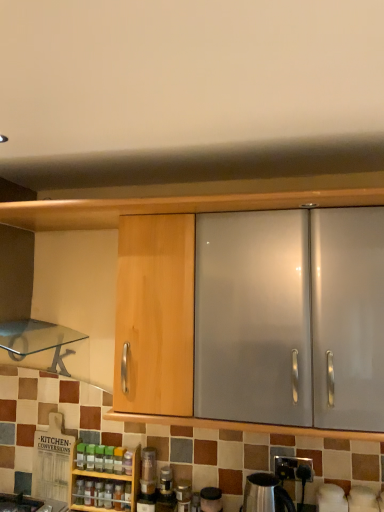
What do you see at coordinates (211, 499) in the screenshot?
I see `metallic silver kettle at center, arranged as the third appliance when viewed from the right` at bounding box center [211, 499].

Locate an element on the screen. This screenshot has height=512, width=384. satin silver kettle at lower center, marked as the second appliance in a left-to-right arrangement is located at coordinates (265, 494).

What do you see at coordinates (265, 494) in the screenshot? I see `satin silver kettle at lower center, marked as the second appliance in a left-to-right arrangement` at bounding box center [265, 494].

Where is `black plastic outlet at lower center`? This screenshot has height=512, width=384. black plastic outlet at lower center is located at coordinates (294, 468).

At what (x,y) coordinates should I click in order to perform the action: click on translucent plastic spice bottle at lower left, the 5th bottle in the left-to-right sequence. Please return your answer as a coordinate pair (x, y). Looking at the image, I should click on (108, 495).

What do you see at coordinates (108, 495) in the screenshot? I see `translucent plastic spice bottle at lower left, the 5th bottle in the left-to-right sequence` at bounding box center [108, 495].

What do you see at coordinates (118, 496) in the screenshot? This screenshot has width=384, height=512. I see `translucent plastic bottle at center, the third bottle positioned from the right` at bounding box center [118, 496].

This screenshot has width=384, height=512. I want to click on metallic silver kettle at center, marked as the first appliance in a left-to-right arrangement, so click(211, 499).

Is translucent plastic bottle at center, positioned as the 2th bottle in left-to-right order, facing away from translucent plastic bottles at center, which ranks as the eighth bottle in right-to-left order?

That's not correct — translucent plastic bottle at center, positioned as the 2th bottle in left-to-right order, is not looking away from translucent plastic bottles at center, which ranks as the eighth bottle in right-to-left order.

From the image's perspective, is translucent plastic bottle at center, positioned as the 2th bottle in left-to-right order, under translucent plastic bottles at center, which ranks as the eighth bottle in right-to-left order?

Yes.

How distant is translucent plastic bottle at center, positioned as the 2th bottle in left-to-right order, from translucent plastic bottles at center, the first bottle in the left-to-right sequence?

The distance of translucent plastic bottle at center, positioned as the 2th bottle in left-to-right order, from translucent plastic bottles at center, the first bottle in the left-to-right sequence, is 3.99 inches.

Looking at the image, does translucent plastic bottle at center, positioned as the 2th bottle in left-to-right order, seem bigger or smaller compared to translucent plastic bottles at center, the first bottle in the left-to-right sequence?

Clearly, translucent plastic bottle at center, positioned as the 2th bottle in left-to-right order, is smaller in size than translucent plastic bottles at center, the first bottle in the left-to-right sequence.

From a real-world perspective, which object rests below the other?

translucent plastic spice bottle at lower left, the 5th bottle in the left-to-right sequence.

Is translucent plastic spice bottle at lower left, the 5th bottle in the left-to-right sequence, bigger or smaller than green plastic bottle at lower center, the fifth bottle positioned from the right?

Clearly, translucent plastic spice bottle at lower left, the 5th bottle in the left-to-right sequence, is larger in size than green plastic bottle at lower center, the fifth bottle positioned from the right.

Which is in front, translucent plastic spice bottle at lower left, the fourth bottle positioned from the right, or green plastic bottle at lower center, acting as the 4th bottle starting from the left?

translucent plastic spice bottle at lower left, the fourth bottle positioned from the right, is in front.

Could you measure the distance between translucent plastic spice bottle at lower left, the fourth bottle positioned from the right, and green plastic bottle at lower center, acting as the 4th bottle starting from the left?

translucent plastic spice bottle at lower left, the fourth bottle positioned from the right, is 3.64 inches away from green plastic bottle at lower center, acting as the 4th bottle starting from the left.

Which is in front, point (99, 466) or point (89, 508)?

The point (89, 508) is closer.

From a real-world perspective, is green plastic bottle at center, which is the 3th bottle from left to right, positioned under wooden spice rack at lower center based on gravity?

No, from a real-world perspective, green plastic bottle at center, which is the 3th bottle from left to right, is not beneath wooden spice rack at lower center.

Can you confirm if green plastic bottle at center, which is the 6th bottle in right-to-left order, is thinner than wooden spice rack at lower center?

Indeed, green plastic bottle at center, which is the 6th bottle in right-to-left order, has a lesser width compared to wooden spice rack at lower center.

The height and width of the screenshot is (512, 384). I want to click on cabinet located below the satin silver kettle at lower center, marked as the second appliance in a left-to-right arrangement (from the image's perspective), so click(x=107, y=478).

Can you confirm if satin silver kettle at lower center, marked as the second appliance in a right-to-left arrangement, is thinner than wooden spice rack at lower center?

No.

From the picture: Is satin silver kettle at lower center, marked as the second appliance in a right-to-left arrangement, oriented towards wooden spice rack at lower center?

No, satin silver kettle at lower center, marked as the second appliance in a right-to-left arrangement, is not facing towards wooden spice rack at lower center.

Can we say satin silver kettle at lower center, marked as the second appliance in a left-to-right arrangement, lies outside wooden spice rack at lower center?

satin silver kettle at lower center, marked as the second appliance in a left-to-right arrangement, is positioned outside wooden spice rack at lower center.

Between translucent glass jar at lower center, which is the first bottle in right-to-left order, and translucent plastic bottles at center, the first bottle in the left-to-right sequence, which one has smaller width?

With smaller width is translucent plastic bottles at center, the first bottle in the left-to-right sequence.

Who is more distant, translucent glass jar at lower center, which is the eighth bottle from left to right, or translucent plastic bottles at center, which ranks as the eighth bottle in right-to-left order?

translucent plastic bottles at center, which ranks as the eighth bottle in right-to-left order, is behind.

Does translucent glass jar at lower center, which is the eighth bottle from left to right, have a smaller size compared to translucent plastic bottles at center, the first bottle in the left-to-right sequence?

No.

Which is more to the left, translucent glass jar at lower center, which is the first bottle in right-to-left order, or translucent plastic bottles at center, which ranks as the eighth bottle in right-to-left order?

translucent plastic bottles at center, which ranks as the eighth bottle in right-to-left order, is more to the left.

Considering the sizes of objects translucent plastic bottle at center, positioned as the 2th bottle in left-to-right order, and green plastic bottle at lower center, the fifth bottle positioned from the right, in the image provided, who is shorter, translucent plastic bottle at center, positioned as the 2th bottle in left-to-right order, or green plastic bottle at lower center, the fifth bottle positioned from the right,?

green plastic bottle at lower center, the fifth bottle positioned from the right.

Considering the sizes of objects translucent plastic bottle at center, arranged as the 7th bottle when viewed from the right, and green plastic bottle at lower center, acting as the 4th bottle starting from the left, in the image provided, who is bigger, translucent plastic bottle at center, arranged as the 7th bottle when viewed from the right, or green plastic bottle at lower center, acting as the 4th bottle starting from the left,?

green plastic bottle at lower center, acting as the 4th bottle starting from the left, is bigger.

Is translucent plastic bottle at center, arranged as the 7th bottle when viewed from the right, with green plastic bottle at lower center, the fifth bottle positioned from the right?

No, translucent plastic bottle at center, arranged as the 7th bottle when viewed from the right, is not beside green plastic bottle at lower center, the fifth bottle positioned from the right.

This screenshot has height=512, width=384. Identify the location of the 1st bottle behind the translucent plastic bottle at center, arranged as the 7th bottle when viewed from the right. (109, 459).

Considering their positions, is translucent plastic bottle at center, positioned as the 2th bottle in left-to-right order, located in front of or behind translucent glass jar at lower center, which is the eighth bottle from left to right?

Visually, translucent plastic bottle at center, positioned as the 2th bottle in left-to-right order, is located behind translucent glass jar at lower center, which is the eighth bottle from left to right.

Looking at this image, is translucent plastic bottle at center, positioned as the 2th bottle in left-to-right order, located outside translucent glass jar at lower center, which is the eighth bottle from left to right?

Yes.

What's the angular difference between translucent plastic bottle at center, arranged as the 7th bottle when viewed from the right, and translucent glass jar at lower center, which is the first bottle in right-to-left order,'s facing directions?

The angle between the facing direction of translucent plastic bottle at center, arranged as the 7th bottle when viewed from the right, and the facing direction of translucent glass jar at lower center, which is the first bottle in right-to-left order, is 1.26 degrees.

From the image's perspective, is translucent plastic bottle at center, arranged as the 7th bottle when viewed from the right, located beneath translucent glass jar at lower center, which is the eighth bottle from left to right?

Actually, translucent plastic bottle at center, arranged as the 7th bottle when viewed from the right, appears above translucent glass jar at lower center, which is the eighth bottle from left to right, in the image.

The image size is (384, 512). In order to click on the 3rd bottle in front of the translucent plastic bottles at center, which ranks as the eighth bottle in right-to-left order, counting from the anchor's position in this screenshot , I will do `click(99, 493)`.

In order to click on the 1st bottle to the left when counting from the translucent plastic spice bottle at lower left, the fourth bottle positioned from the right in this screenshot , I will do `click(109, 459)`.

Which object lies nearer to the anchor point translucent plastic bottle at center, the third bottle positioned from the right, wooden spice rack at lower center or white glossy kettle at lower right, which appears as the 1th appliance when viewed from the right?

wooden spice rack at lower center is positioned closer to the anchor translucent plastic bottle at center, the third bottle positioned from the right.

Looking at the image, which one is located closer to translucent plastic spice at center, the seventh bottle when ordered from left to right, white glossy kettle at lower right, which ranks as the 3th appliance in left-to-right order, or translucent plastic spice bottle at lower left, the fourth bottle positioned from the right?

translucent plastic spice bottle at lower left, the fourth bottle positioned from the right.

Which object lies further to the anchor point translucent plastic bottles at center, which ranks as the eighth bottle in right-to-left order, white glossy kettle at lower right, which appears as the 1th appliance when viewed from the right, or translucent plastic bottle at center, the sixth bottle positioned from the left?

The object further to translucent plastic bottles at center, which ranks as the eighth bottle in right-to-left order, is white glossy kettle at lower right, which appears as the 1th appliance when viewed from the right.

In the scene shown: Estimate the real-world distances between objects in this image. Which object is further from translucent plastic spice bottle at lower left, the 5th bottle in the left-to-right sequence, translucent glass jar at lower center, which is the first bottle in right-to-left order, or metallic silver kettle at center, marked as the first appliance in a left-to-right arrangement?

metallic silver kettle at center, marked as the first appliance in a left-to-right arrangement.

Consider the image. Looking at the image, which one is located closer to white glossy kettle at lower right, which appears as the 1th appliance when viewed from the right, green plastic bottle at lower center, the fifth bottle positioned from the right, or translucent plastic bottle at center, arranged as the 7th bottle when viewed from the right?

The object closer to white glossy kettle at lower right, which appears as the 1th appliance when viewed from the right, is green plastic bottle at lower center, the fifth bottle positioned from the right.

Consider the image. Based on their spatial positions, is satin silver kettle at lower center, marked as the second appliance in a right-to-left arrangement, or wooden spice rack at lower center closer to black plastic outlet at lower center?

Among the two, satin silver kettle at lower center, marked as the second appliance in a right-to-left arrangement, is located nearer to black plastic outlet at lower center.

In the scene shown: Estimate the real-world distances between objects in this image. Which object is closer to green plastic bottle at center, which is the 6th bottle in right-to-left order, wooden spice rack at lower center or translucent glass jar at lower center, which is the eighth bottle from left to right?

wooden spice rack at lower center is closer to green plastic bottle at center, which is the 6th bottle in right-to-left order.

Looking at the image, which one is located further to green plastic bottle at center, which is the 6th bottle in right-to-left order, white glossy kettle at lower right, which ranks as the 3th appliance in left-to-right order, or black plastic outlet at lower center?

The object further to green plastic bottle at center, which is the 6th bottle in right-to-left order, is white glossy kettle at lower right, which ranks as the 3th appliance in left-to-right order.

Where is `cabinet located between translucent plastic bottle at center, positioned as the 2th bottle in left-to-right order, and translucent glass jar at lower center, which is the eighth bottle from left to right, in the left-right direction`? The width and height of the screenshot is (384, 512). cabinet located between translucent plastic bottle at center, positioned as the 2th bottle in left-to-right order, and translucent glass jar at lower center, which is the eighth bottle from left to right, in the left-right direction is located at coordinates (107, 478).

Where is `bottle situated between translucent plastic spice at center, the second bottle positioned from the right, and white glossy kettle at lower right, which appears as the 1th appliance when viewed from the right, from left to right`? The height and width of the screenshot is (512, 384). bottle situated between translucent plastic spice at center, the second bottle positioned from the right, and white glossy kettle at lower right, which appears as the 1th appliance when viewed from the right, from left to right is located at coordinates (183, 496).

Where is `electric outlet between translucent plastic bottle at center, the sixth bottle positioned from the left, and white glossy kettle at lower right, which appears as the 1th appliance when viewed from the right, in the horizontal direction`? electric outlet between translucent plastic bottle at center, the sixth bottle positioned from the left, and white glossy kettle at lower right, which appears as the 1th appliance when viewed from the right, in the horizontal direction is located at coordinates (294, 468).

The height and width of the screenshot is (512, 384). What are the coordinates of `appliance between wooden spice rack at lower center and satin silver kettle at lower center, marked as the second appliance in a right-to-left arrangement` in the screenshot? It's located at (211, 499).